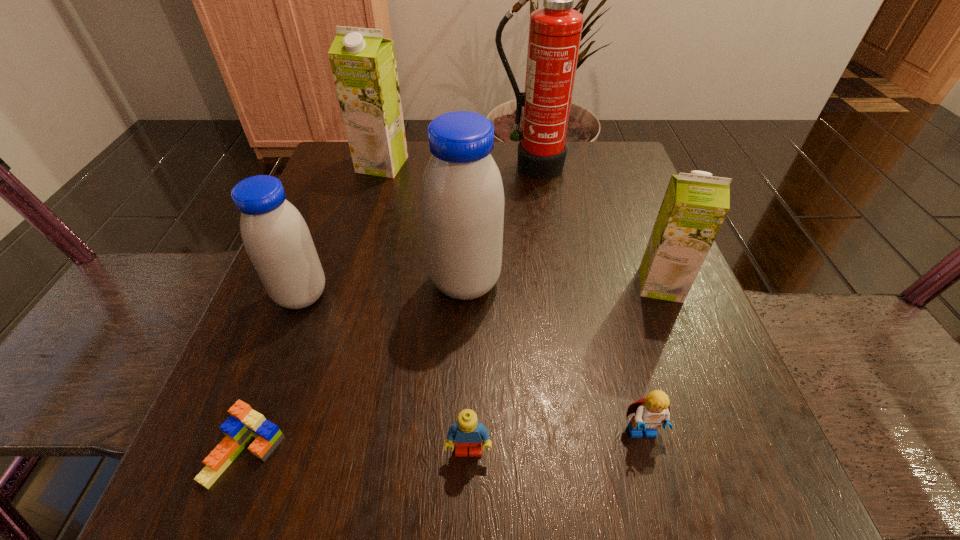
Identify which soya milk is located as the second nearest to the right green soya milk. Please provide its 2D coordinates. Your answer should be formatted as a tuple, i.e. [(x, y)], where the tuple contains the x and y coordinates of a point satisfying the conditions above.

[(363, 63)]

The height and width of the screenshot is (540, 960). I want to click on Lego that is the third closest to the fire extinguisher, so click(x=244, y=424).

Locate which Lego ranks third in proximity to the fire extinguisher. Please provide its 2D coordinates. Your answer should be formatted as a tuple, i.e. [(x, y)], where the tuple contains the x and y coordinates of a point satisfying the conditions above.

[(244, 424)]

At what (x,y) coordinates should I click in order to perform the action: click on free spot that satisfies the following two spatial constraints: 1. on the front-facing side of the right green soya milk; 2. on the right side of the red fire extinguisher. Please return your answer as a coordinate pair (x, y). The height and width of the screenshot is (540, 960). Looking at the image, I should click on (549, 285).

Locate an element on the screen. The image size is (960, 540). free point that satisfies the following two spatial constraints: 1. on the front-facing side of the tallest object; 2. on the right side of the right green soya milk is located at coordinates tap(549, 285).

Image resolution: width=960 pixels, height=540 pixels. Find the location of `free space that satisfies the following two spatial constraints: 1. on the front-facing side of the fire extinguisher; 2. on the left side of the nearer green soya milk`. free space that satisfies the following two spatial constraints: 1. on the front-facing side of the fire extinguisher; 2. on the left side of the nearer green soya milk is located at coordinates (549, 285).

Locate an element on the screen. The width and height of the screenshot is (960, 540). vacant area in the image that satisfies the following two spatial constraints: 1. on the back side of the nearer green soya milk; 2. on the left side of the smaller blue soya milk is located at coordinates (305, 285).